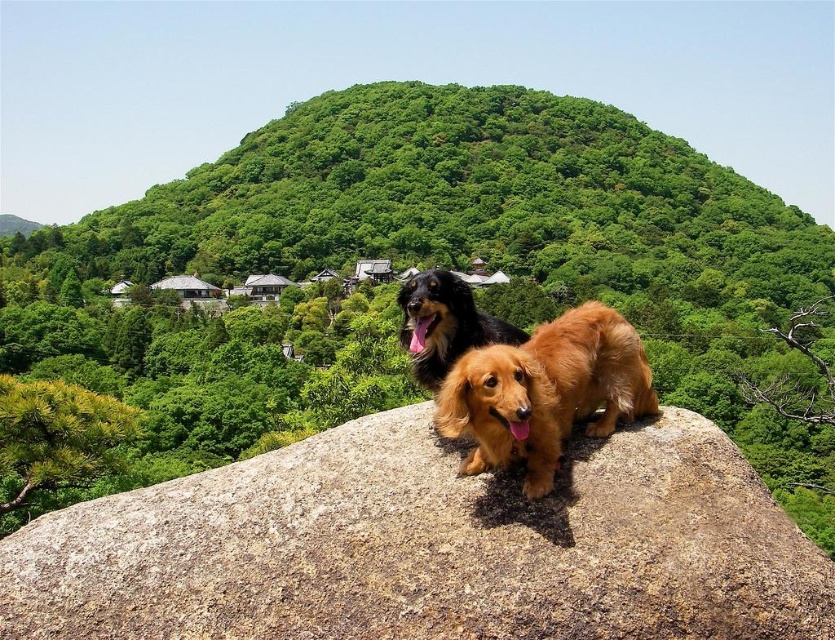
You are planning to place a small garden shed in the scene. The shed requires a flat area wider than the brown textured rock at center. Can the green leafy hillside at center provide a suitable location?

The green leafy hillside at center is wider than the brown textured rock at center, so it can provide a suitable location for the garden shed since its width exceeds the required area.

You are a hiker trying to reach the top of the green leafy hillside at center. You see the shiny black fur at center in your path. Can you walk around it to reach the hilltop?

The shiny black fur at center is behind the green leafy hillside at center, so you can walk around it to reach the hilltop.

You are standing at the point marked as point (428,268) in the image. What is the nearest object to you?

The nearest object to you is the green leafy hillside at center because the point (428,268) corresponds to it.